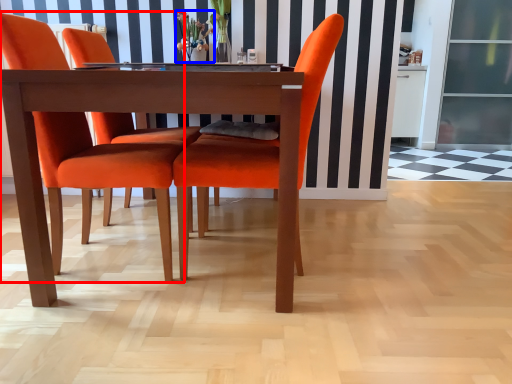
Question: Which object appears closest to the camera in this image, chair (highlighted by a red box) or floral arrangement (highlighted by a blue box)?

Choices:
 (A) chair
 (B) floral arrangement

Answer: (A)